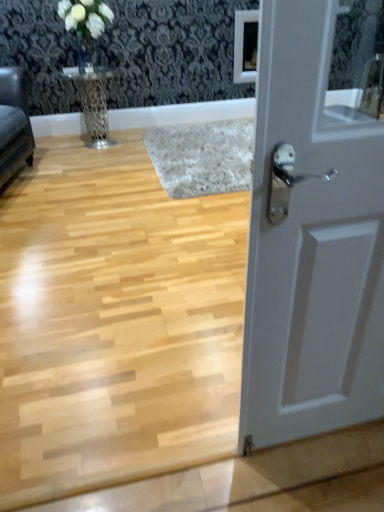
Question: Can you confirm if white matte door at right is taller than velvet dark gray sofa at left?

Choices:
 (A) yes
 (B) no

Answer: (A)

Question: Can you confirm if white matte door at right is thinner than velvet dark gray sofa at left?

Choices:
 (A) yes
 (B) no

Answer: (A)

Question: From the image's perspective, is white matte door at right under velvet dark gray sofa at left?

Choices:
 (A) yes
 (B) no

Answer: (A)

Question: Is white matte door at right beside velvet dark gray sofa at left?

Choices:
 (A) no
 (B) yes

Answer: (A)

Question: Is white matte door at right looking in the opposite direction of velvet dark gray sofa at left?

Choices:
 (A) yes
 (B) no

Answer: (B)

Question: In terms of width, does velvet dark gray sofa at left look wider or thinner when compared to metallic silver table at upper left?

Choices:
 (A) wide
 (B) thin

Answer: (B)

Question: Considering the positions of point (18, 165) and point (92, 81), is point (18, 165) closer or farther from the camera than point (92, 81)?

Choices:
 (A) closer
 (B) farther

Answer: (A)

Question: Would you say velvet dark gray sofa at left is inside or outside metallic silver table at upper left?

Choices:
 (A) outside
 (B) inside

Answer: (A)

Question: Is velvet dark gray sofa at left bigger or smaller than metallic silver table at upper left?

Choices:
 (A) big
 (B) small

Answer: (A)

Question: In terms of size, does metallic silver table at upper left appear bigger or smaller than velvet dark gray sofa at left?

Choices:
 (A) small
 (B) big

Answer: (A)

Question: Relative to velvet dark gray sofa at left, is metallic silver table at upper left in front or behind?

Choices:
 (A) behind
 (B) front

Answer: (A)

Question: Visually, is metallic silver table at upper left positioned to the left or to the right of velvet dark gray sofa at left?

Choices:
 (A) right
 (B) left

Answer: (A)

Question: Considering the positions of metallic silver table at upper left and velvet dark gray sofa at left in the image, is metallic silver table at upper left wider or thinner than velvet dark gray sofa at left?

Choices:
 (A) wide
 (B) thin

Answer: (A)

Question: Would you say white matte door at right is to the left or to the right of velvet dark gray sofa at left in the picture?

Choices:
 (A) left
 (B) right

Answer: (B)

Question: Considering the positions of white matte door at right and velvet dark gray sofa at left in the image, is white matte door at right bigger or smaller than velvet dark gray sofa at left?

Choices:
 (A) small
 (B) big

Answer: (A)